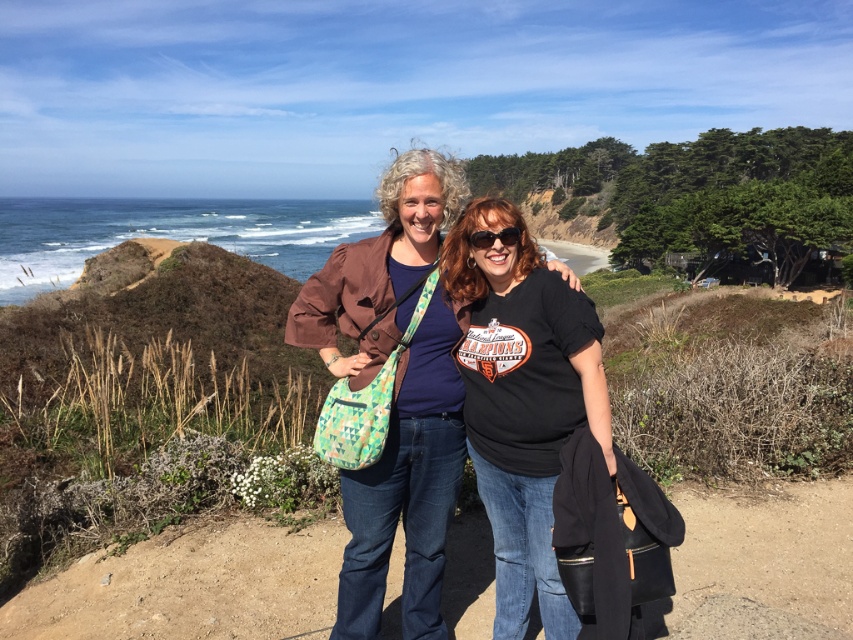
You are a photographer standing at the center of the dirt path in the coastal area. You want to take a photo that includes both the point at coordinates point (397, 205) and point (476, 230). Which point is closer to the camera so that you can focus on it first?

Point (397, 205) is further to the camera than point (476, 230). Therefore, point (397, 205) is closer to the camera and should be focused on first.

Looking at this image, you are a photographer trying to capture a clear shot of the black plastic sunglasses at center. There is a matte brown jacket at center blocking your view. Can you tell me which direction you should move to get the sunglasses into frame without the jacket obstructing?

The matte brown jacket at center is positioned on the left side of black plastic sunglasses at center. To avoid the obstruction, move to the right side of the jacket so the sunglasses become visible to the right of the jacket.